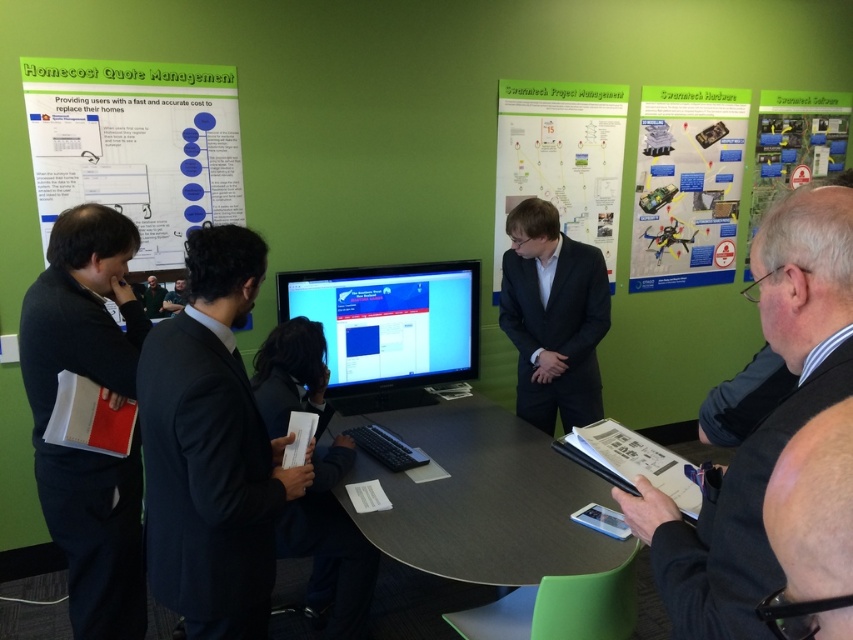
Question: Which object is the closest to the matte black monitor at center?

Choices:
 (A) dark gray suit at center
 (B) green fabric shirt at center
 (C) matte black drone at upper right
 (D) gray suit jacket at upper right

Answer: (A)

Question: Does black fabric business suit at left have a larger size compared to matte black drone at upper right?

Choices:
 (A) no
 (B) yes

Answer: (A)

Question: Estimate the real-world distances between objects in this image. Which object is closer to the white paper at upper left?

Choices:
 (A) dark gray suit at center
 (B) dark gray table at center
 (C) green matte poster at upper right

Answer: (B)

Question: Which object is farther from the camera taking this photo?

Choices:
 (A) green matte poster at upper center
 (B) dark gray table at center
 (C) gray suit jacket at upper right
 (D) black fabric business suit at left

Answer: (A)

Question: Does green matte poster at upper right come in front of green fabric shirt at center?

Choices:
 (A) no
 (B) yes

Answer: (A)

Question: Is skinny black glasses at lower right closer to camera compared to green matte poster at upper right?

Choices:
 (A) yes
 (B) no

Answer: (A)